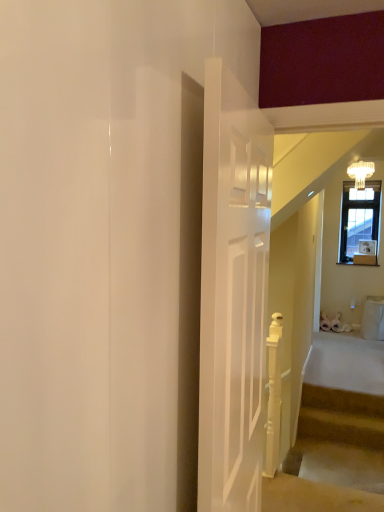
Question: Relative to carpeted stairs at lower right, is white glass chandelier at upper right in front or behind?

Choices:
 (A) front
 (B) behind

Answer: (B)

Question: From the image's perspective, is white glass chandelier at upper right located above or below carpeted stairs at lower right?

Choices:
 (A) above
 (B) below

Answer: (A)

Question: Is white glass chandelier at upper right to the left or to the right of carpeted stairs at lower right in the image?

Choices:
 (A) left
 (B) right

Answer: (B)

Question: Looking at the image, does carpeted stairs at lower right seem bigger or smaller compared to white glass chandelier at upper right?

Choices:
 (A) small
 (B) big

Answer: (B)

Question: From the image's perspective, is carpeted stairs at lower right located above or below white glass chandelier at upper right?

Choices:
 (A) above
 (B) below

Answer: (B)

Question: Would you say carpeted stairs at lower right is to the left or to the right of white glass chandelier at upper right in the picture?

Choices:
 (A) left
 (B) right

Answer: (A)

Question: Relative to white glass chandelier at upper right, is carpeted stairs at lower right in front or behind?

Choices:
 (A) front
 (B) behind

Answer: (A)